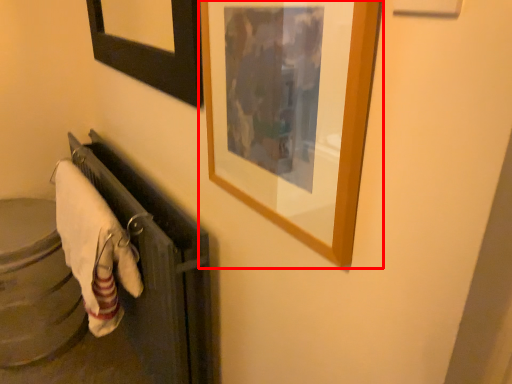
Question: From the image's perspective, where is picture frame (annotated by the red box) located relative to bath towel?

Choices:
 (A) above
 (B) below

Answer: (A)